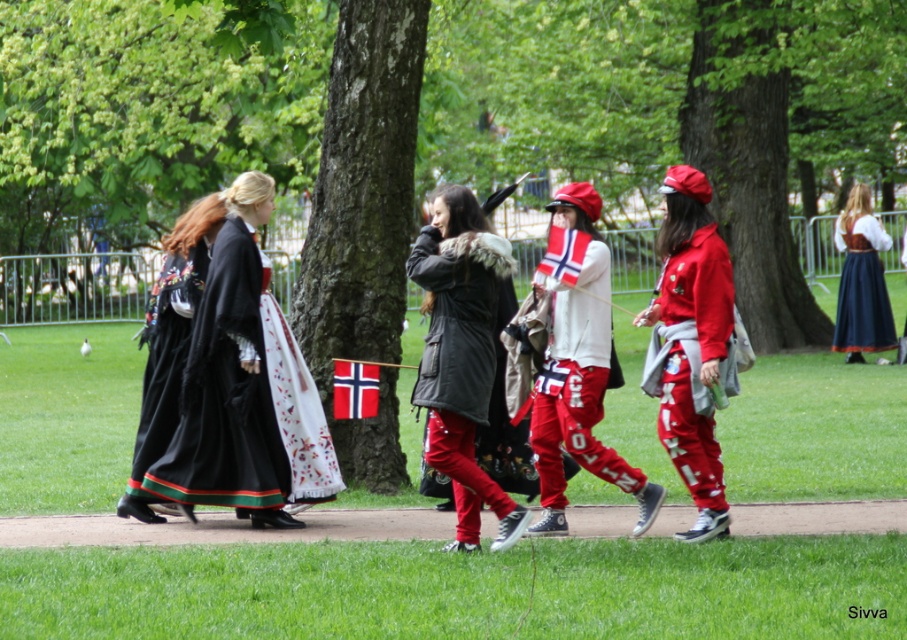
You are a photographer at the event and want to capture both the black satin dress at left and the matte black coat at center in a single shot. Based on their positions, which object should you focus on first to ensure both are in frame?

The black satin dress at left is located above the matte black coat at center, so focusing on the coat first and adjusting the camera angle downward would ensure both are in frame.

You are attending a Norwegian cultural event and see two attendees dressed in black. You notice a black satin dress at left and a matte black coat at center. Which clothing item is positioned closer to the left side of the scene?

The black satin dress at left is positioned closer to the left side of the scene compared to the matte black coat at center.